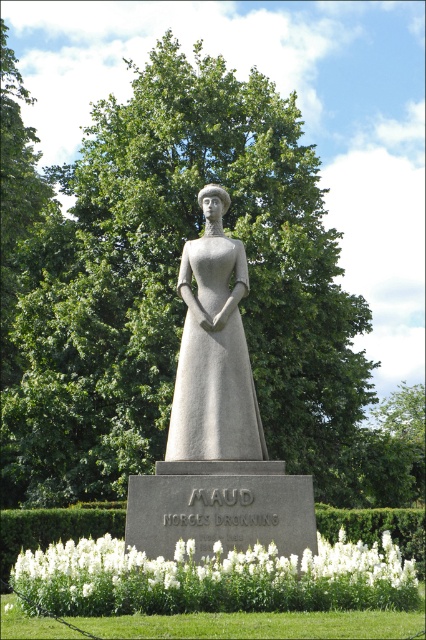
You are an art conservator examining the statue of Queen Maud. You notice the gray stone statue at center and the gray stone dress at center. Which part of the statue is positioned lower?

The gray stone statue at center is located below the gray stone dress at center, so the statue itself is positioned lower than the dress.